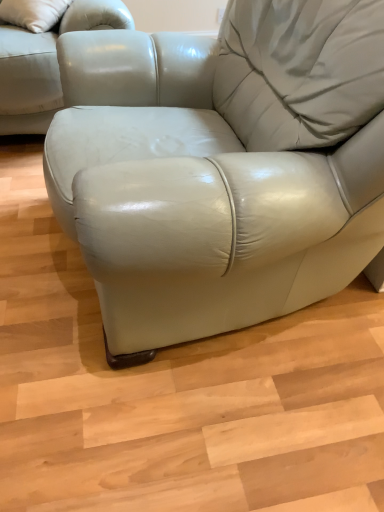
Question: Considering the positions of matte leather couch at upper left and matte leather armchair at center in the image, is matte leather couch at upper left taller or shorter than matte leather armchair at center?

Choices:
 (A) short
 (B) tall

Answer: (B)

Question: Considering their positions, is matte leather couch at upper left located in front of or behind matte leather armchair at center?

Choices:
 (A) front
 (B) behind

Answer: (B)

Question: From a real-world perspective, is matte leather couch at upper left physically located above or below matte leather armchair at center?

Choices:
 (A) below
 (B) above

Answer: (B)

Question: From the image's perspective, is matte leather armchair at center positioned above or below matte leather couch at upper left?

Choices:
 (A) above
 (B) below

Answer: (B)

Question: Is matte leather armchair at center inside or outside of matte leather couch at upper left?

Choices:
 (A) inside
 (B) outside

Answer: (B)

Question: In terms of size, does matte leather armchair at center appear bigger or smaller than matte leather couch at upper left?

Choices:
 (A) big
 (B) small

Answer: (A)

Question: Is matte leather armchair at center wider or thinner than matte leather couch at upper left?

Choices:
 (A) wide
 (B) thin

Answer: (A)